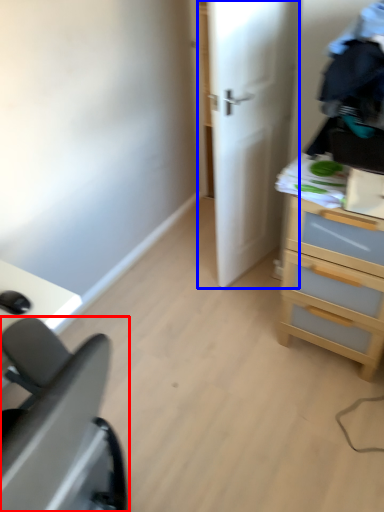
Question: Among these objects, which one is farthest to the camera, furniture (highlighted by a red box) or door (highlighted by a blue box)?

Choices:
 (A) furniture
 (B) door

Answer: (B)